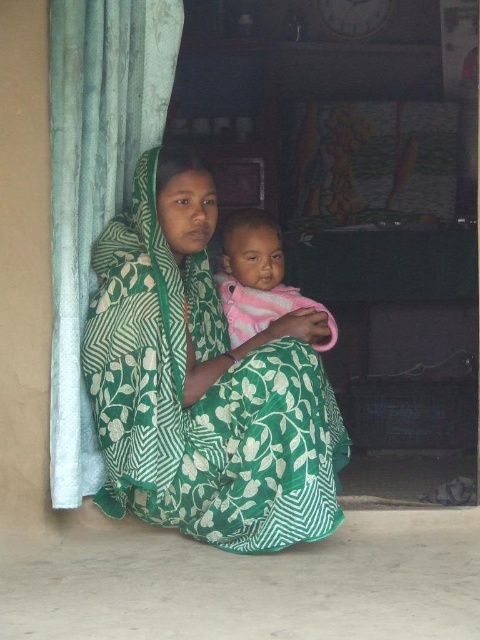
Is green printed fabric at center smaller than pink soft fabric baby at center?

No, green printed fabric at center is not smaller than pink soft fabric baby at center.

Does point (212, 544) come in front of point (260, 256)?

Yes, point (212, 544) is closer to viewer.

Where is `green printed fabric at center`? green printed fabric at center is located at coordinates (203, 381).